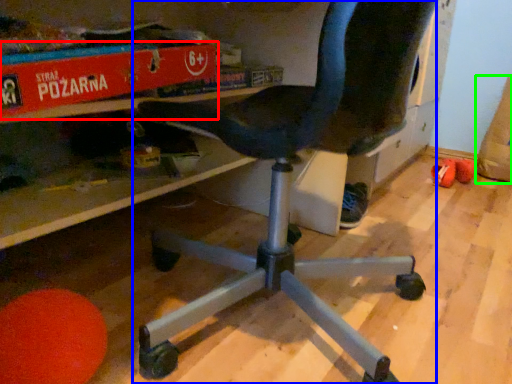
Question: Based on their relative distances, which object is nearer to paperback book (highlighted by a red box)? Choose from chair (highlighted by a blue box) and bean bag chair (highlighted by a green box).

Choices:
 (A) chair
 (B) bean bag chair

Answer: (A)